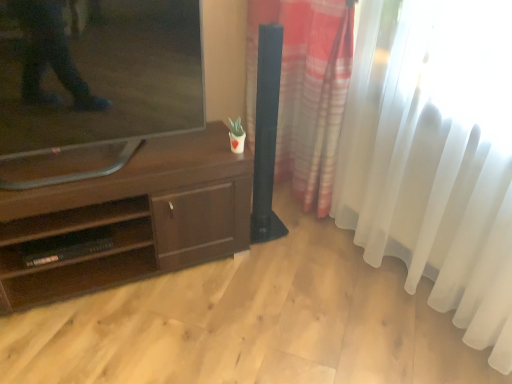
Question: Does matte black tv at left appear on the right side of dark brown wood tv stand at center?

Choices:
 (A) yes
 (B) no

Answer: (A)

Question: From the image's perspective, is matte black tv at left on dark brown wood tv stand at center?

Choices:
 (A) no
 (B) yes

Answer: (B)

Question: Is there a large distance between matte black tv at left and dark brown wood tv stand at center?

Choices:
 (A) yes
 (B) no

Answer: (B)

Question: From a real-world perspective, does matte black tv at left stand above dark brown wood tv stand at center?

Choices:
 (A) no
 (B) yes

Answer: (B)

Question: Can you confirm if matte black tv at left is smaller than dark brown wood tv stand at center?

Choices:
 (A) no
 (B) yes

Answer: (B)

Question: Considering the relative sizes of matte black tv at left and dark brown wood tv stand at center in the image provided, is matte black tv at left wider than dark brown wood tv stand at center?

Choices:
 (A) yes
 (B) no

Answer: (B)

Question: Is dark brown wood tv stand at center bigger than matte black tv at left?

Choices:
 (A) no
 (B) yes

Answer: (B)

Question: Considering the relative sizes of dark brown wood tv stand at center and matte black tv at left in the image provided, is dark brown wood tv stand at center wider than matte black tv at left?

Choices:
 (A) no
 (B) yes

Answer: (B)

Question: Is matte black tv at left a part of dark brown wood tv stand at center?

Choices:
 (A) no
 (B) yes

Answer: (A)

Question: Does dark brown wood tv stand at center have a smaller size compared to matte black tv at left?

Choices:
 (A) yes
 (B) no

Answer: (B)

Question: Would you say dark brown wood tv stand at center is outside matte black tv at left?

Choices:
 (A) no
 (B) yes

Answer: (B)

Question: Could you tell me if dark brown wood tv stand at center is facing matte black tv at left?

Choices:
 (A) no
 (B) yes

Answer: (A)

Question: Is black plastic shelf at lower left further to the viewer compared to dark brown wood tv stand at center?

Choices:
 (A) yes
 (B) no

Answer: (A)